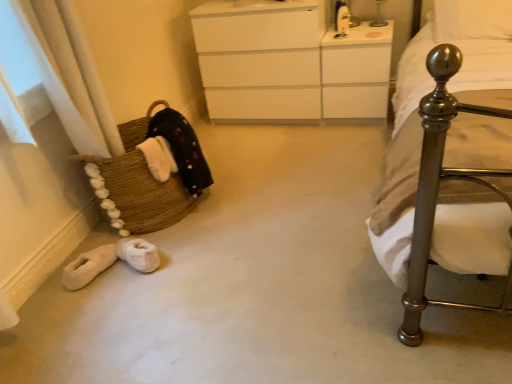
You are a GUI agent. You are given a task and a screenshot of the screen. Output one action in this format:
    pyautogui.click(x=<x>, y=<y>)
    Task: Click on the free space in front of brown woven basket at left
    
    Given the screenshot: What is the action you would take?
    pyautogui.click(x=175, y=269)